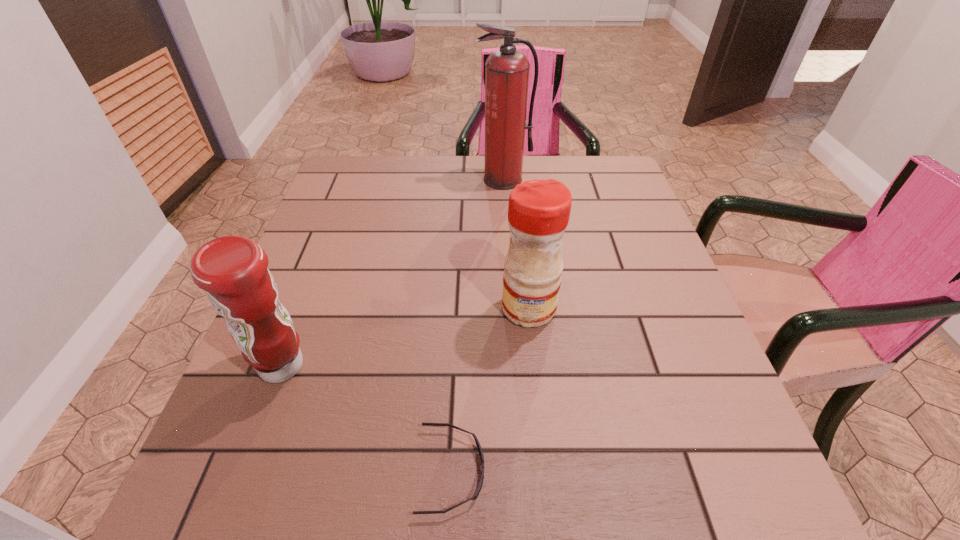
Where is `free space located 0.310m on the right of the leftmost object`? This screenshot has height=540, width=960. free space located 0.310m on the right of the leftmost object is located at coordinates (486, 366).

You are a GUI agent. You are given a task and a screenshot of the screen. Output one action in this format:
    pyautogui.click(x=<x>, y=<y>)
    Task: Click on the blank space located on the front-facing side of the nearest object
    The height and width of the screenshot is (540, 960).
    Given the screenshot: What is the action you would take?
    pyautogui.click(x=524, y=470)

Where is `object at the far edge`? This screenshot has width=960, height=540. object at the far edge is located at coordinates (506, 71).

Where is `object at the near edge`? object at the near edge is located at coordinates (480, 484).

Locate an element on the screen. The image size is (960, 540). object that is at the left edge is located at coordinates (233, 271).

The width and height of the screenshot is (960, 540). In the image, there is a desktop. In order to click on vacant space at the far edge in this screenshot , I will do `click(462, 177)`.

Where is `vacant region at the near edge of the desktop`? The height and width of the screenshot is (540, 960). vacant region at the near edge of the desktop is located at coordinates (563, 481).

I want to click on vacant space at the left edge, so click(x=351, y=274).

Where is `vacant area at the right edge of the desktop`? The height and width of the screenshot is (540, 960). vacant area at the right edge of the desktop is located at coordinates (664, 410).

You are a GUI agent. You are given a task and a screenshot of the screen. Output one action in this format:
    pyautogui.click(x=<x>, y=<y>)
    Task: Click on the free region at the far left corner of the desktop
    
    Given the screenshot: What is the action you would take?
    pyautogui.click(x=388, y=170)